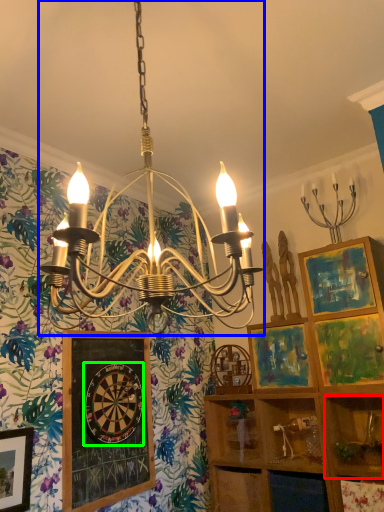
Question: Estimate the real-world distances between objects in this image. Which object is closer to shelf (highlighted by a red box), lamp (highlighted by a blue box) or design (highlighted by a green box)?

Choices:
 (A) lamp
 (B) design

Answer: (A)